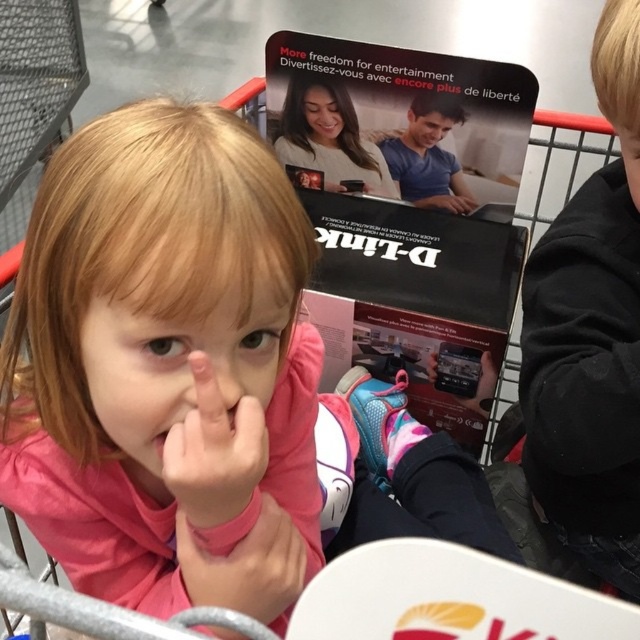
Question: Is black cotton hoodie at upper right above smooth skin girl at center?

Choices:
 (A) yes
 (B) no

Answer: (B)

Question: Which of these objects is positioned closest to the black cotton hoodie at upper right?

Choices:
 (A) pink matte hand at center
 (B) smooth blue shirt at center
 (C) smooth skin girl at center
 (D) pink fleece jacket at upper left

Answer: (D)

Question: Which of the following is the closest to the observer?

Choices:
 (A) (589, 225)
 (B) (285, 125)

Answer: (A)

Question: Where is pink fleece jacket at upper left located in relation to pink matte hand at center in the image?

Choices:
 (A) right
 (B) left

Answer: (B)

Question: Is pink fleece jacket at upper left positioned at the back of black cotton hoodie at upper right?

Choices:
 (A) no
 (B) yes

Answer: (A)

Question: Which of the following is the farthest from the observer?

Choices:
 (A) smooth blue shirt at center
 (B) pink fleece jacket at upper left
 (C) pink matte hand at center

Answer: (A)